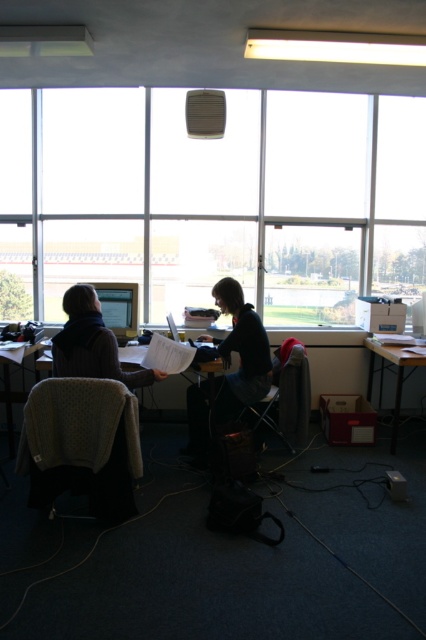
Is the position of transparent glass window at center less distant than that of matte black monitor at left?

No, transparent glass window at center is further to the viewer.

Between transparent glass window at center and matte black monitor at left, which one appears on the left side from the viewer's perspective?

Positioned to the left is matte black monitor at left.

Between point (201, 160) and point (83, 285), which one is positioned behind?

Point (201, 160)

Where is `transparent glass window at center`? transparent glass window at center is located at coordinates (221, 196).

Can you confirm if metallic gray chair at center is thinner than white plastic table at center?

No, metallic gray chair at center is not thinner than white plastic table at center.

Is point (290, 412) farther from camera compared to point (213, 374)?

Yes, point (290, 412) is farther from viewer.

Where is `metallic gray chair at center`? The image size is (426, 640). metallic gray chair at center is located at coordinates (287, 394).

Consider the image. Who is more distant from viewer, (213, 417) or (8, 428)?

Positioned behind is point (8, 428).

Does point (135, 346) lie in front of point (9, 456)?

No, (135, 346) is further to viewer.

Find the location of a particular element. white plastic table at center is located at coordinates (212, 385).